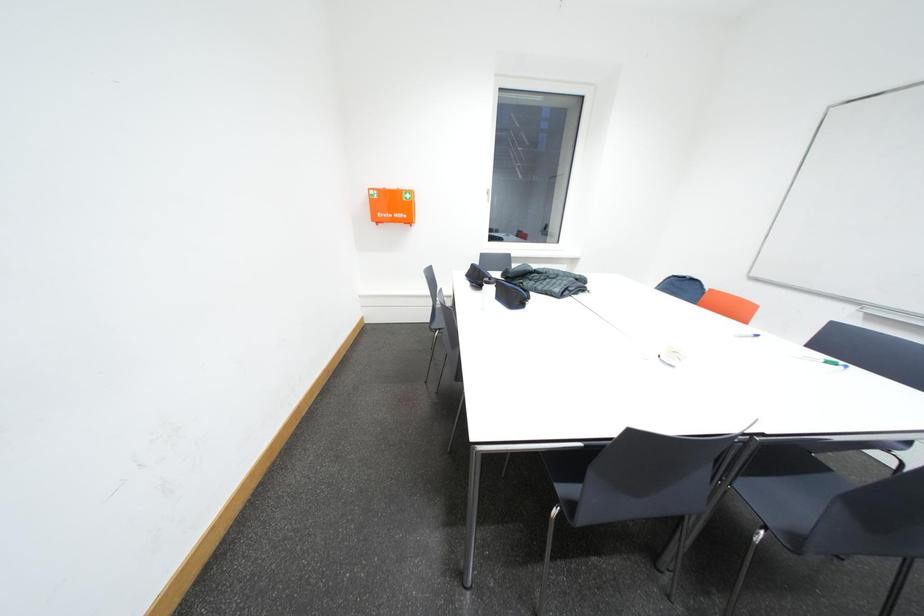
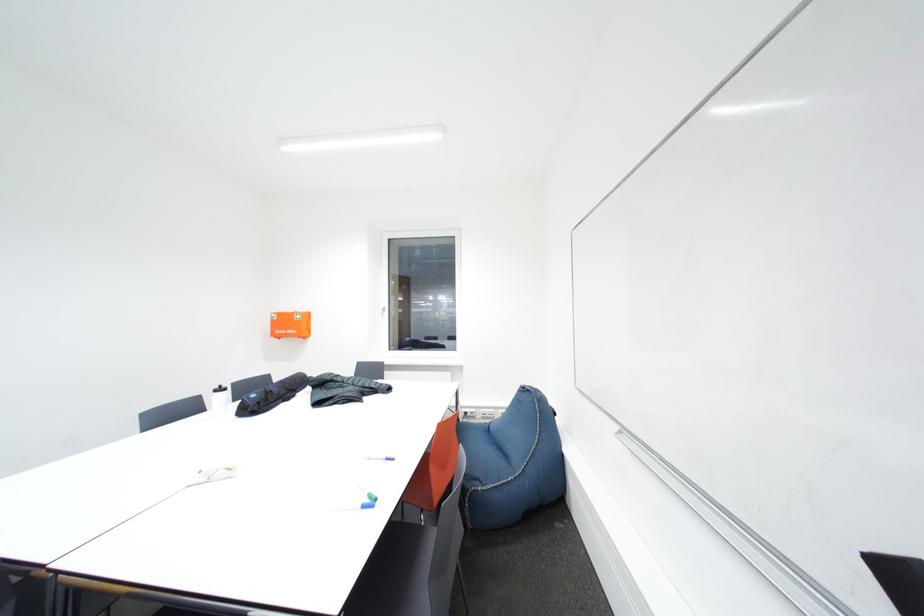
Question: What movement of the cameraman would produce the second image?

Choices:
 (A) Left
 (B) Right
 (C) Forward
 (D) Backward

Answer: (B)